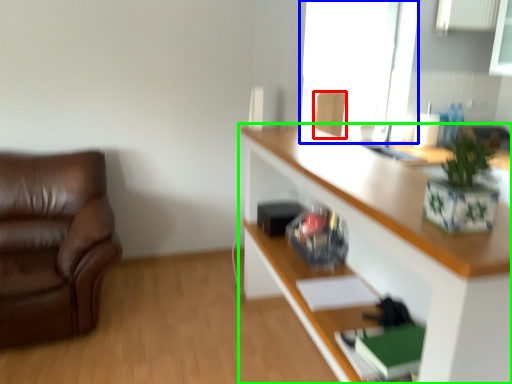
Question: Which object is the closest to the chair (highlighted by a red box)? Choose among these: window (highlighted by a blue box) or cabinetry (highlighted by a green box).

Choices:
 (A) window
 (B) cabinetry

Answer: (A)